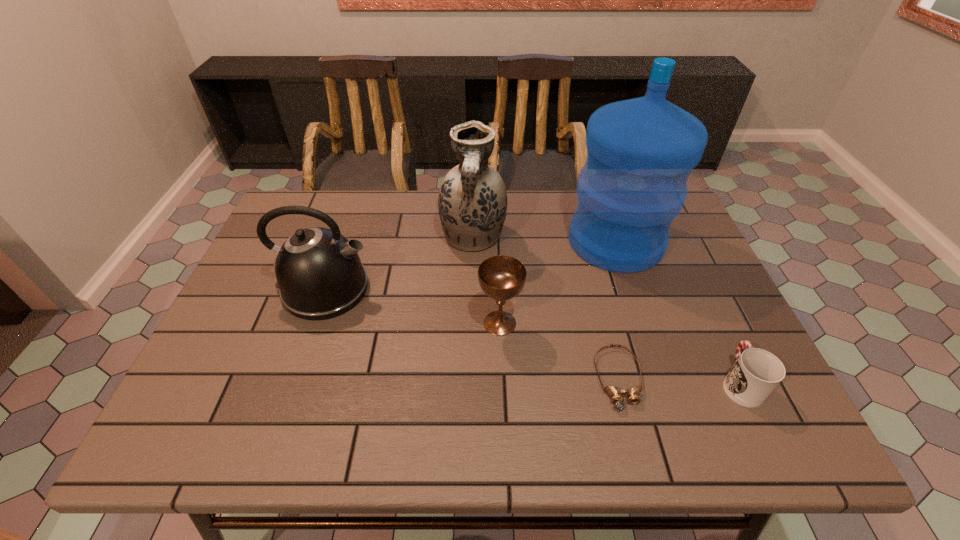
Where is `the tallest object`? The height and width of the screenshot is (540, 960). the tallest object is located at coordinates 641,151.

The image size is (960, 540). Identify the location of vase. (472, 201).

Find the location of a particular element. This screenshot has width=960, height=540. the leftmost object is located at coordinates (319, 273).

Find the location of `kettle`. kettle is located at coordinates pos(319,273).

The width and height of the screenshot is (960, 540). Identify the location of chalice. (501, 277).

Locate an element on the screen. cup is located at coordinates (756, 372).

The height and width of the screenshot is (540, 960). Identify the location of the shortest object. (616, 394).

Where is `vacant space located 0.140m on the front of the tallest object`? This screenshot has height=540, width=960. vacant space located 0.140m on the front of the tallest object is located at coordinates (639, 314).

This screenshot has height=540, width=960. I want to click on vacant point located 0.270m with the handle on the side of the vase, so click(471, 340).

At what (x,y) coordinates should I click in order to perform the action: click on vacant space located 0.270m on the spout of the leftmost object. Please return your answer as a coordinate pair (x, y). Looking at the image, I should click on (476, 289).